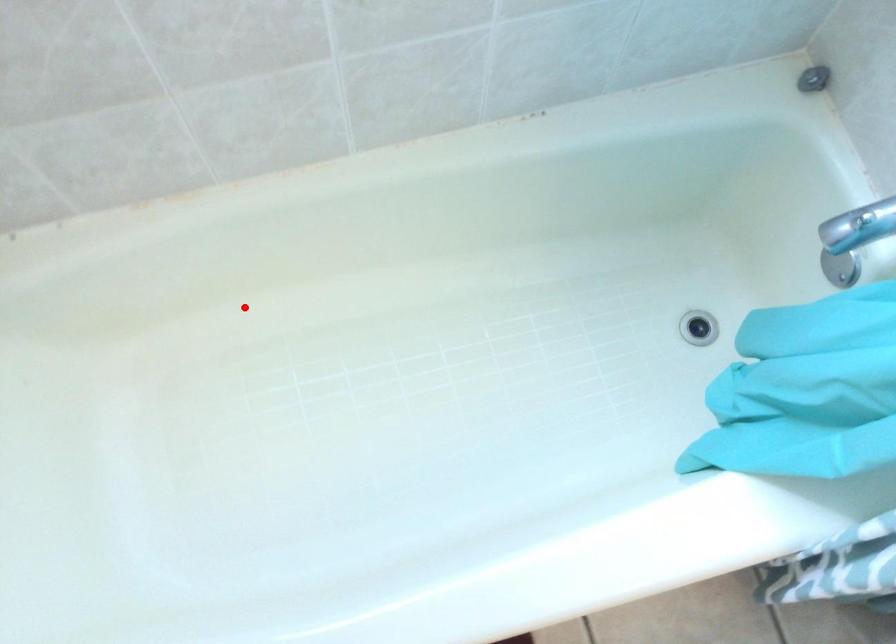
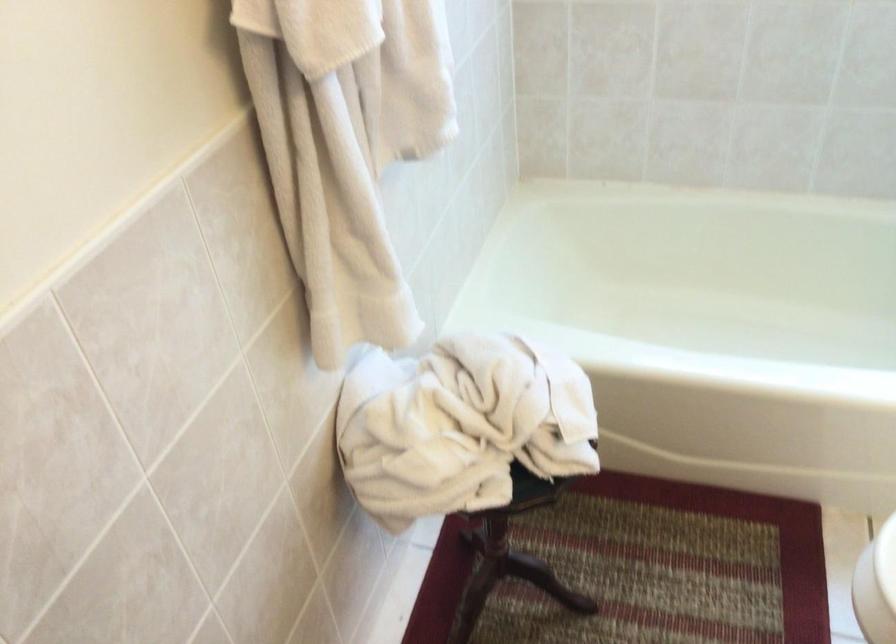
Locate, in the second image, the point that corresponds to the highlighted location in the first image.

(698, 283)